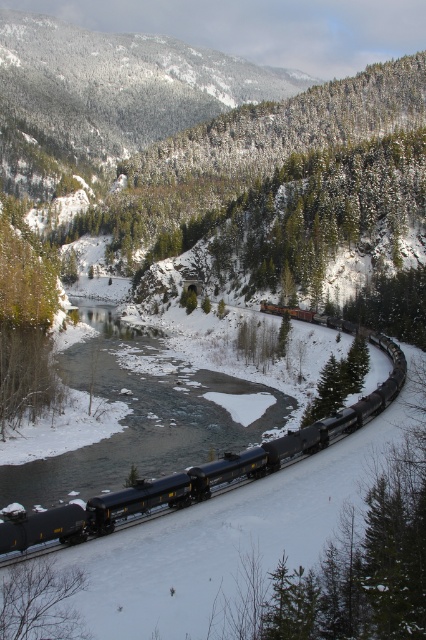
Is matte black train at lower center in front of green textured pine at left?

Yes.

Does matte black train at lower center have a greater height compared to green textured pine at left?

Incorrect, matte black train at lower center's height is not larger of green textured pine at left's.

The height and width of the screenshot is (640, 426). What are the coordinates of `matte black train at lower center` in the screenshot? It's located at (196, 474).